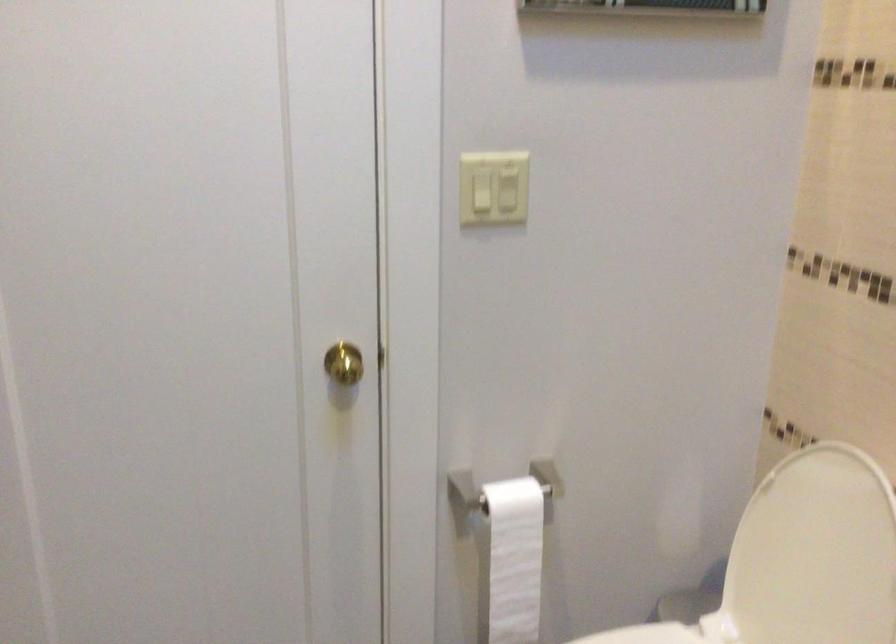
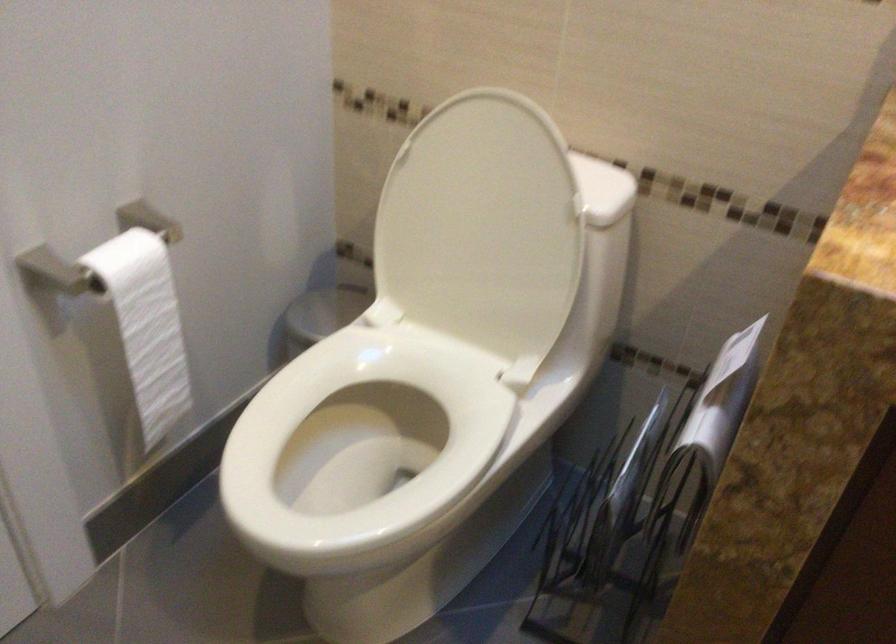
Find the pixel in the second image that matches (822,574) in the first image.

(483, 228)